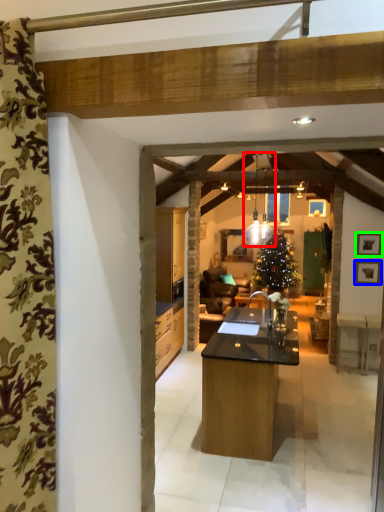
Question: Estimate the real-world distances between objects in this image. Which object is closer to light fixture (highlighted by a red box), picture frame (highlighted by a blue box) or picture frame (highlighted by a green box)?

Choices:
 (A) picture frame
 (B) picture frame

Answer: (B)